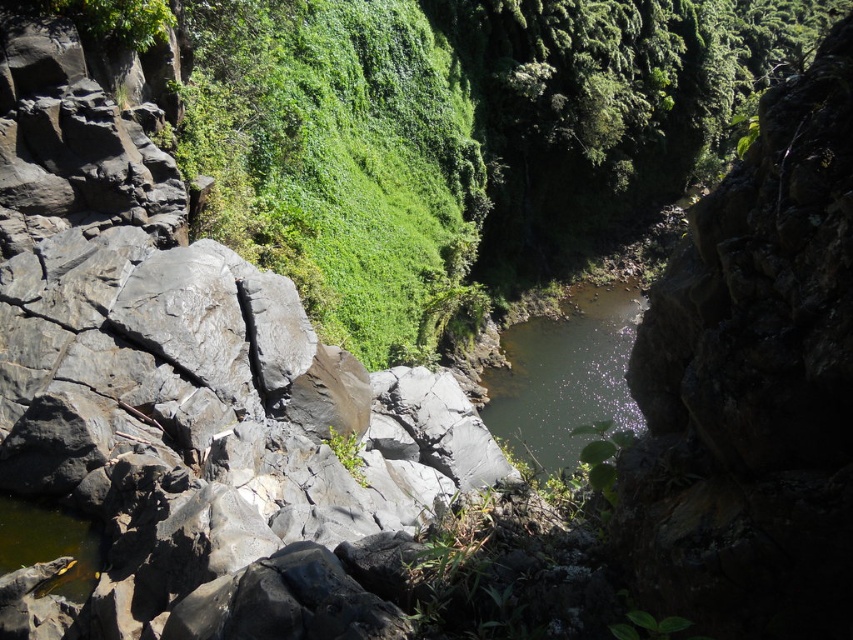
You are standing at the edge of the rocky cliff face on the left. You notice a point marked at coordinates (340,163). What is the closest object to that point?

The closest object to the point marked at coordinates (340,163) is the green leafy vegetation at center, as it is located exactly at that point.

You are a hiker who wants to cross the greenish reflective water at center. You have a 2m long wooden plank. The green leafy vegetation at center is blocking your path. Can you use the plank to cross the water?

The green leafy vegetation at center is taller than the greenish reflective water at center. Since the vegetation is blocking the path, you can clear the vegetation and place the 2m plank over the water to cross safely.

You are standing at a viewpoint overlooking the landscape. You notice two points marked in the scene. The first point is located at coordinates point (329,132), and the second point is at point (563,452). Which of these two points is closer to your current position?

Point (329,132) is in front of point (563,452), so it is closer to your current position.